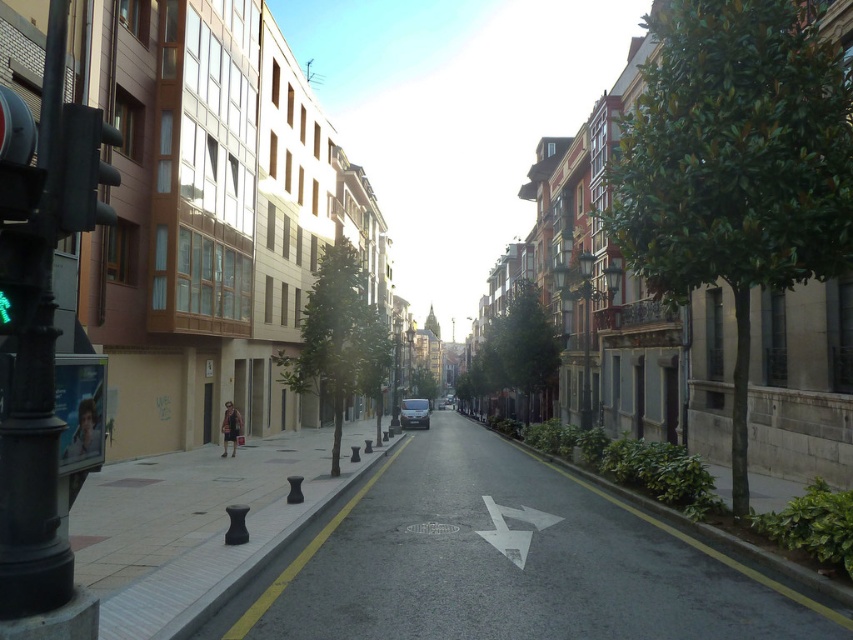
Question: Observing the image, what is the correct spatial positioning of matte black traffic light at left in reference to white paper arrow at center?

Choices:
 (A) above
 (B) below

Answer: (A)

Question: Is smooth concrete pavement at center wider than black rubber bollards at center?

Choices:
 (A) no
 (B) yes

Answer: (B)

Question: Based on their relative distances, which object is nearer to the matte black traffic light at left?

Choices:
 (A) smooth concrete pavement at center
 (B) white paper arrow at center

Answer: (B)

Question: Among these objects, which one is farthest from the camera?

Choices:
 (A) white paper arrow at center
 (B) black metal pole at left

Answer: (A)

Question: Does black rubber bollards at center have a smaller size compared to white paper arrow at center?

Choices:
 (A) no
 (B) yes

Answer: (A)

Question: Which of the following is the closest to the observer?

Choices:
 (A) (471, 456)
 (B) (96, 157)

Answer: (B)